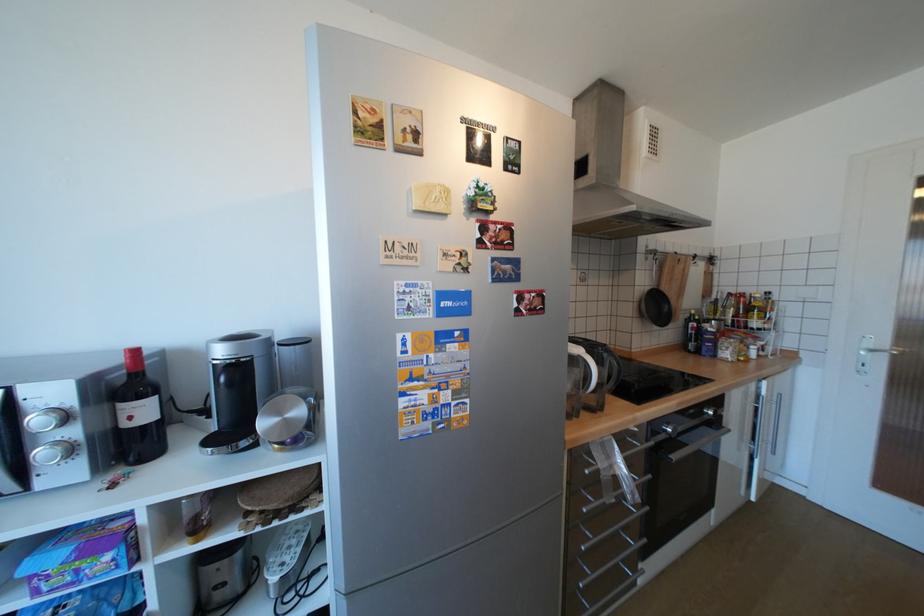
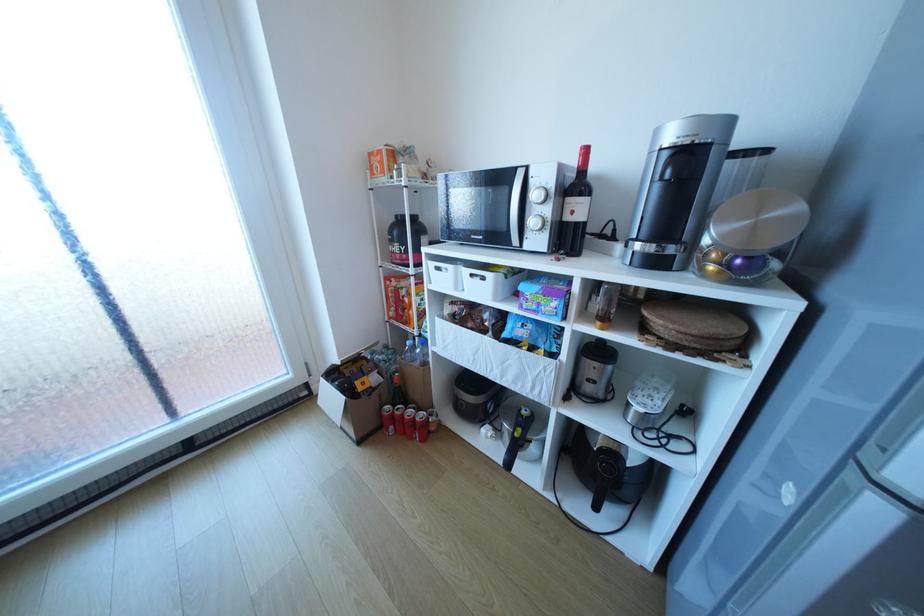
The point at (52, 453) is marked in the first image. Where is the corresponding point in the second image?

(541, 222)